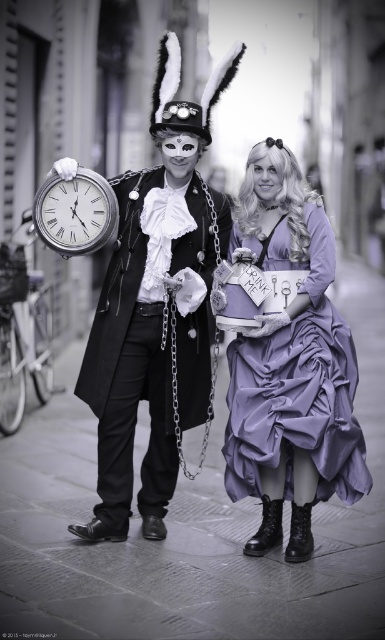
You are standing on the cobblestone street and want to walk from point (257, 257) to point (113, 211). Which direction should you face to move towards your destination?

You should face downward because point (113, 211) is located below point (257, 257).

You are a photographer trying to capture both the matte black coat at center and the lavender satin dress at center in a single shot. However, due to the camera settings, you can only focus on one of them clearly. Which object should you choose to ensure the other is at least partially visible in the background?

You should focus on the matte black coat at center because it is positioned over the lavender satin dress at center, so the dress will still be partially visible in the background.

You are a photographer positioned on the cobblestone street. You need to capture a photo where the lavender satin dress at center is to the right of the silver metallic clock at center. Is this possible based on the scene?

Yes, because the lavender satin dress at center is already positioned to the right of the silver metallic clock at center as described in the scene.